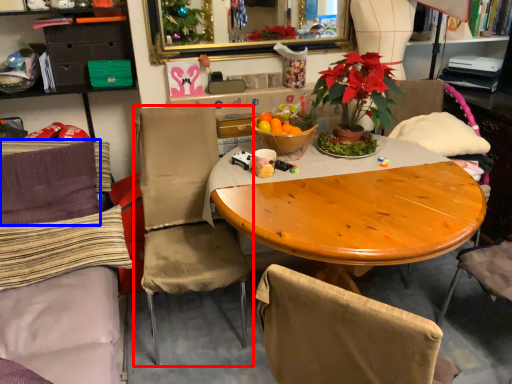
Question: Among these objects, which one is farthest to the camera, chair (highlighted by a red box) or pillow (highlighted by a blue box)?

Choices:
 (A) chair
 (B) pillow

Answer: (B)